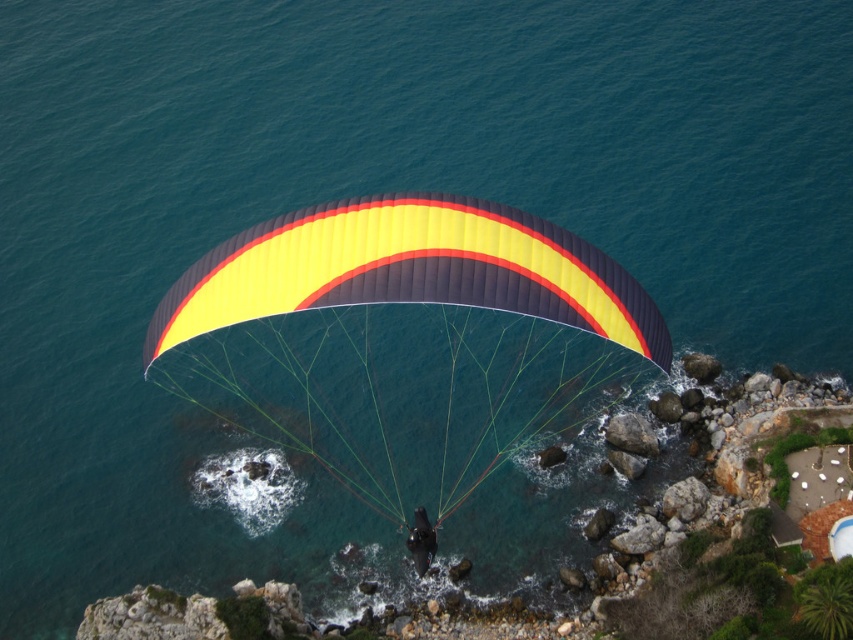
Is yellow matte parachute at center further to the viewer compared to matte black helmet at center?

No, yellow matte parachute at center is closer to the viewer.

Find the location of a particular element. yellow matte parachute at center is located at coordinates (405, 339).